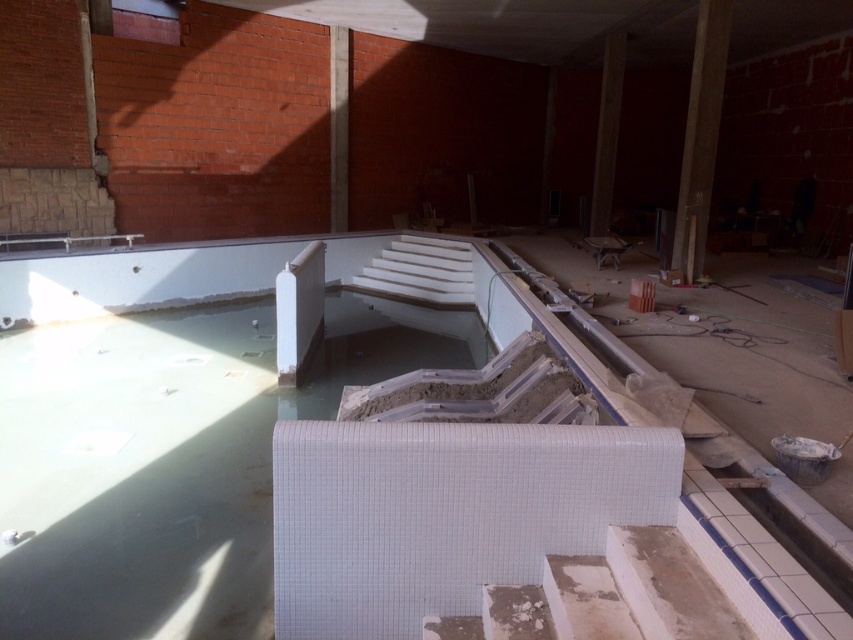
Question: Can you confirm if wooden beam at center is positioned below brown concrete beam at upper center?

Choices:
 (A) yes
 (B) no

Answer: (A)

Question: Does concrete at upper right appear on the left side of brown concrete beam at upper center?

Choices:
 (A) no
 (B) yes

Answer: (A)

Question: Among these points, which one is farthest from the camera?

Choices:
 (A) (339, 124)
 (B) (599, 195)
 (C) (722, 13)

Answer: (A)

Question: Which point is farther from the camera taking this photo?

Choices:
 (A) (329, 38)
 (B) (618, 84)
 (C) (705, 33)

Answer: (A)

Question: Where is concrete at upper right located in relation to wooden beam at center in the image?

Choices:
 (A) above
 (B) below

Answer: (B)

Question: Which point is farther to the camera?

Choices:
 (A) wooden beam at center
 (B) concrete at upper right
 (C) brown concrete beam at upper center

Answer: (C)